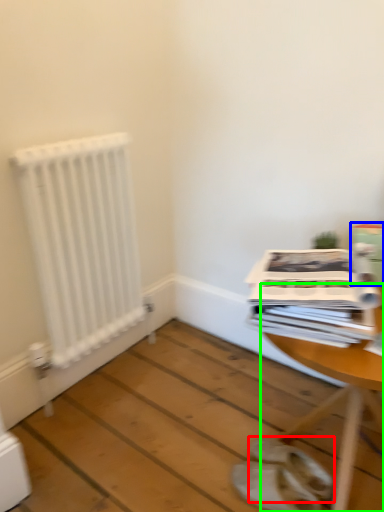
Question: Estimate the real-world distances between objects in this image. Which object is closer to footwear (highlighted by a red box), cardboard box (highlighted by a blue box) or table (highlighted by a green box)?

Choices:
 (A) cardboard box
 (B) table

Answer: (B)